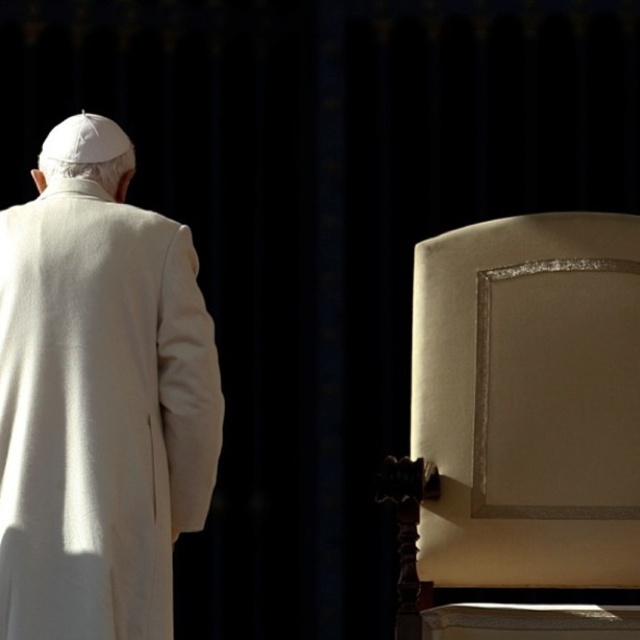
From the picture: You are a photographer positioned in front of the scene. You need to capture a photo where both the satin beige chair at right and the white wool coat at upper left are visible. Based on their positions, which object should be placed on the right side of the photo?

The satin beige chair at right should be placed on the right side of the photo because it is already positioned to the right of the white wool coat at upper left in the scene.

You are a photographer setting up a shoot in this scene. You need to place a small decorative item between the satin beige chair at right and the white wool coat at upper left. Which object should the item be closer to if it needs to be near the smaller one?

The satin beige chair at right is smaller than the white wool coat at upper left, so the decorative item should be placed closer to the satin beige chair at right.